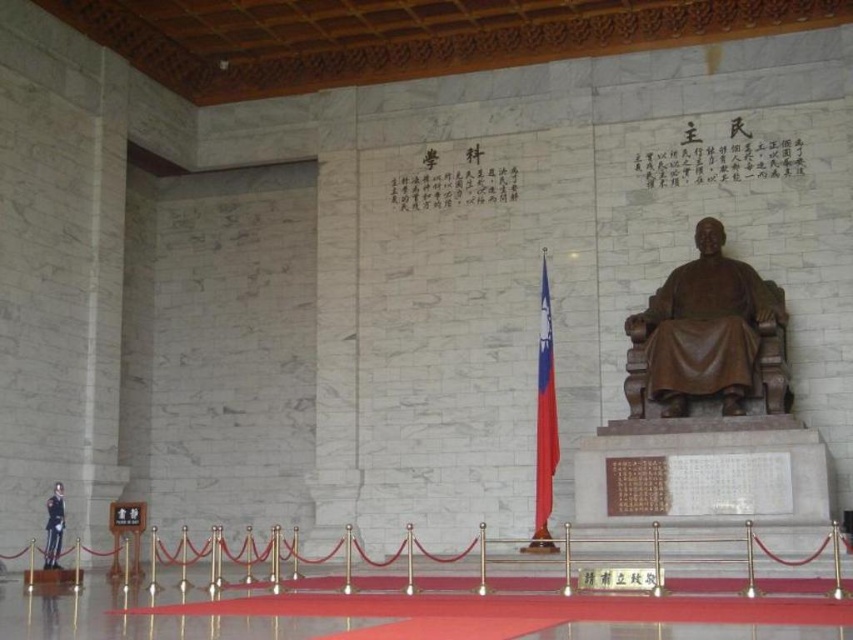
You are standing in the grand hall and want to take a closer look at the bronze statue at center and the bronze statue at lower left. Which statue should you walk towards if you want to reach the one that is nearer to you first?

You should walk towards the bronze statue at center first because it is closer to the viewer than the bronze statue at lower left, so you will reach it sooner.

You are an event planner organizing a ceremony in this grand hall. You need to place a 1.5 meter tall decorative column between the bronze statue at center and the red fabric flag at center. Considering their sizes, will the column fit between them without being too large or too small?

The bronze statue at center is smaller than the red fabric flag at center. Since the column is 1.5 meters tall, it can be placed between them as the flag is larger and the statue is smaller, allowing for a proportional fit.